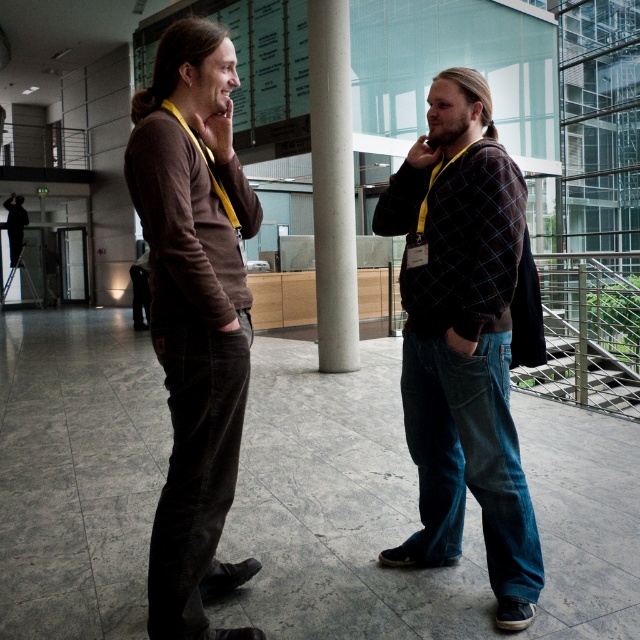
Question: Considering the relative positions of dark blue jeans at center and brown corduroy pants at left in the image provided, where is dark blue jeans at center located with respect to brown corduroy pants at left?

Choices:
 (A) above
 (B) below

Answer: (B)

Question: Based on their relative distances, which object is nearer to the white concrete pillar at center?

Choices:
 (A) dark blue jeans at center
 (B) brown corduroy pants at left

Answer: (A)

Question: Among these points, which one is nearest to the camera?

Choices:
 (A) pos(461,97)
 (B) pos(157,202)
 (C) pos(323,147)

Answer: (B)

Question: Does dark blue jeans at center have a smaller size compared to brown corduroy pants at left?

Choices:
 (A) yes
 (B) no

Answer: (B)

Question: Which point appears farthest from the camera in this image?

Choices:
 (A) (488, 131)
 (B) (340, 182)
 (C) (164, 353)

Answer: (B)

Question: Is dark blue jeans at center behind white concrete pillar at center?

Choices:
 (A) no
 (B) yes

Answer: (A)